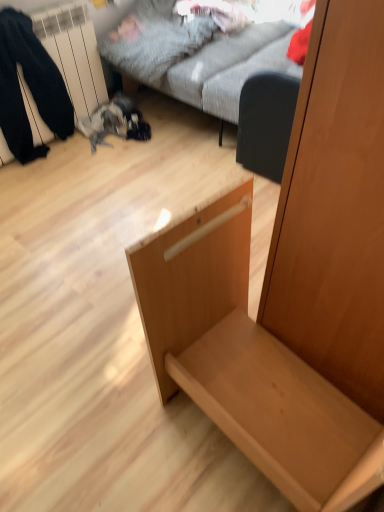
Find the location of a particular element. This screenshot has height=512, width=384. free region on the left part of black matte swivel chair at center-right is located at coordinates (216, 166).